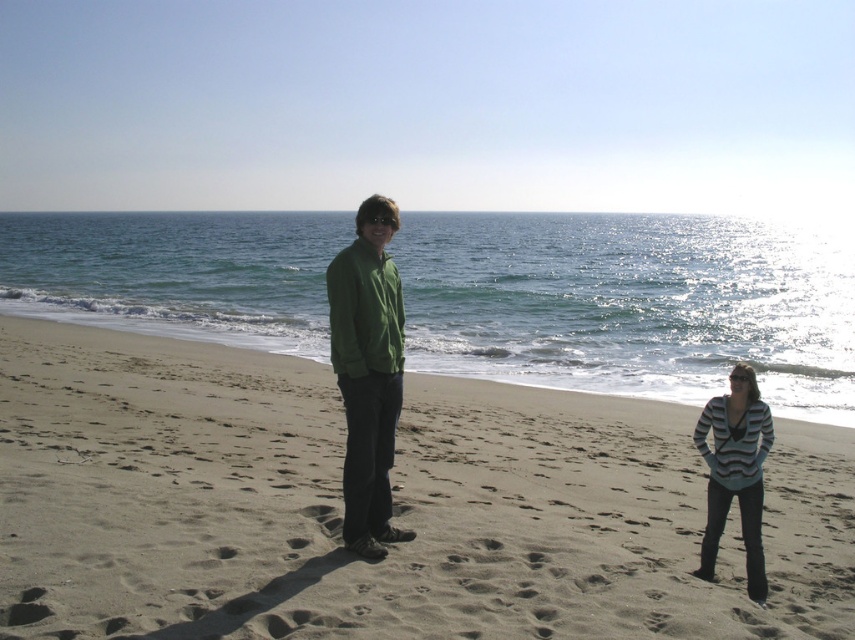
You are a photographer trying to capture a landscape shot of the brown sandy beach at center and the green matte jacket at center. Which object appears taller in the photo?

The green matte jacket at center appears taller than the brown sandy beach at center in the photo.

You are a photographer planning to take a photo of the beach scene. You need to place two markers at the coordinates point [602,520] and point [366,237]. Which marker will appear closer to the camera in the final photo?

Point [602,520] is further to the viewer than point [366,237], so the marker at point [602,520] will appear closer to the camera in the photo.